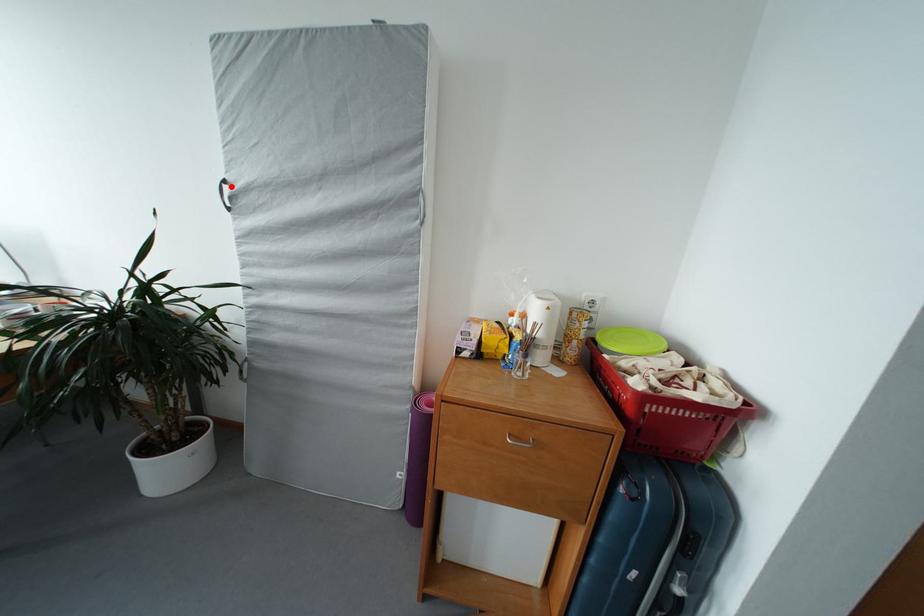
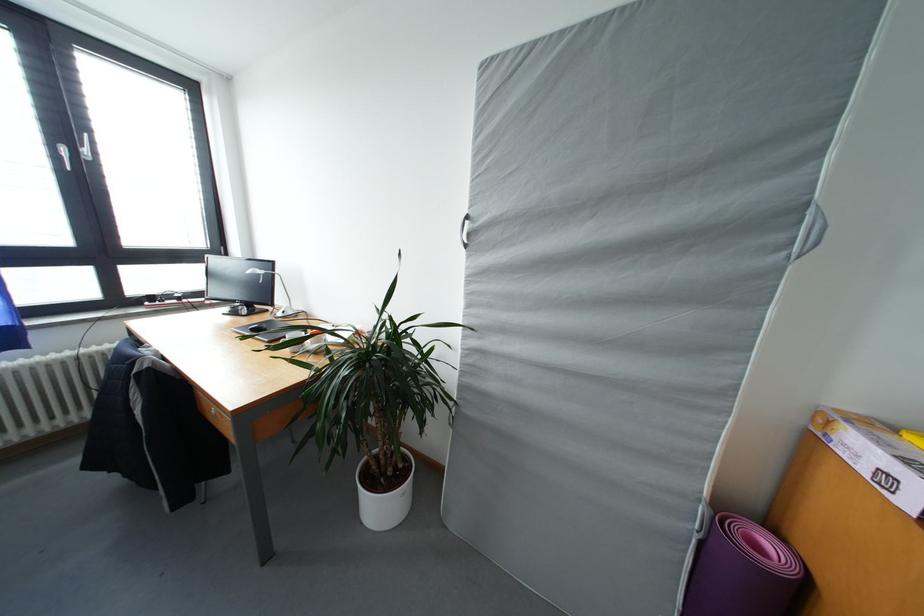
Find the pixel in the second image that matches the highlighted location in the first image.

(473, 222)